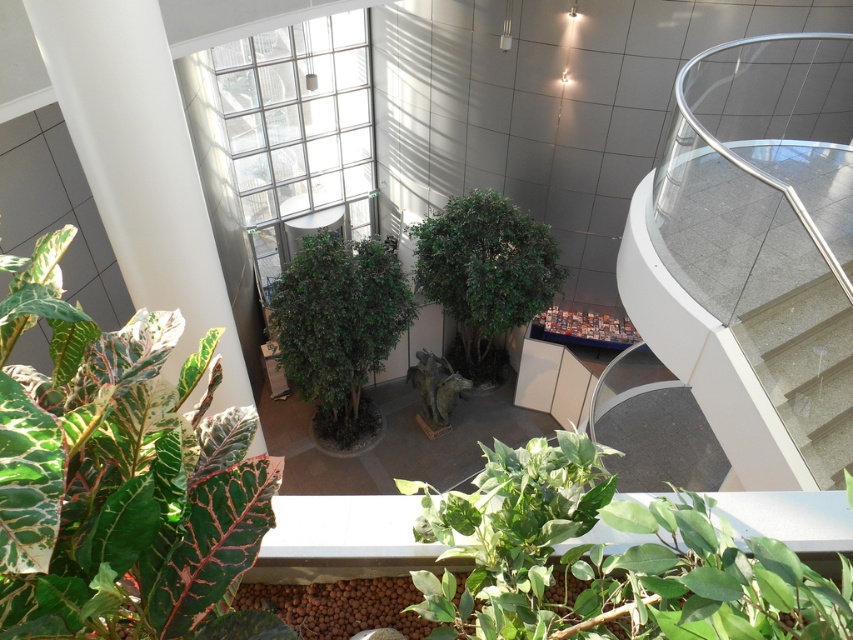
You are standing in the atrium and want to place a new potted plant exactly at the center of the room. Is the current green matte tree at center already occupying that spot?

The green matte tree at center is located at point (339, 326), which is the exact center coordinates of the room. Therefore, the green matte tree at center is already occupying the center spot.

You are a visitor in the atrium and want to take a photo of both the green matte plant at lower center and the green leafy plant at center. Can you stand in a position where you can see both plants in your camera frame at the same time?

The green matte plant at lower center is below the green leafy plant at center, so yes, you can stand in a position where you can see both plants in your camera frame at the same time since they are vertically aligned.

You are standing at the entrance of the atrium and want to place a new potted plant exactly at the center of the atrium. The current green matte plant at lower center is at point 0.875, 0.715. Can you determine if the new plant will be placed to the left or right of the existing one?

The new plant will be placed to the left of the existing green matte plant at lower center because the center of the atrium is at point (426,320), and the existing plant is at (608,560), which is to the right and lower than the center.